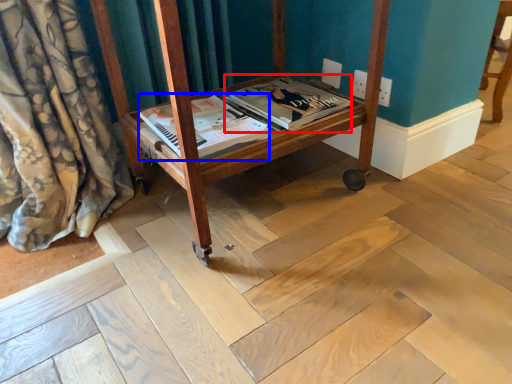
Question: Which of the following is the farthest to the observer, magazine (highlighted by a red box) or magazine (highlighted by a blue box)?

Choices:
 (A) magazine
 (B) magazine

Answer: (A)